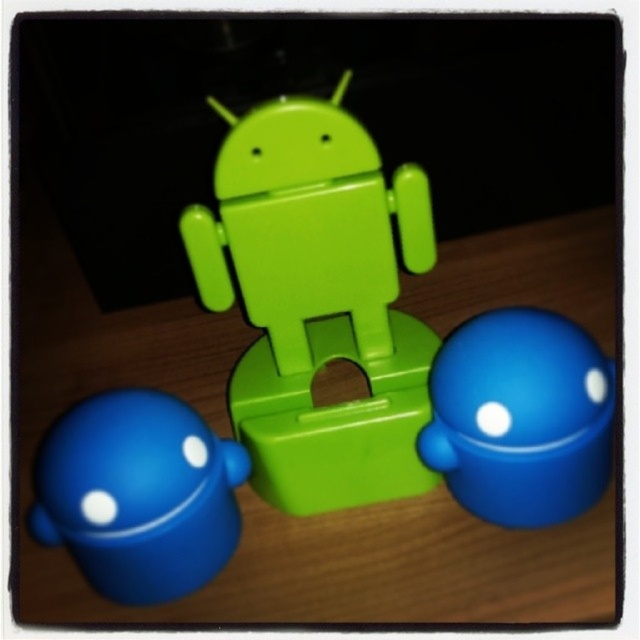
You are a child who wants to place a small toy on top of the wooden table at center. The toy is exactly the same height as the green matte android at center. Will the toy fit on the table without hanging over the edge?

The wooden table at center has a greater height compared to the green matte android at center. Since the toy is the same height as the green matte android at center, it will fit on the table without hanging over the edge because the table is taller than the toy.

You are standing at the point marked as point (260,476) and want to reach the door located at the opposite side of the room. There are three Android figurines in your path. The central green Android is directly in front of you, while the two smaller blue Androids are to your left and right. Considering their positions, which path should you take to avoid them?

To avoid the Android figurines, you should take the path to the left or right of the central green Android, as the two smaller blue Androids are positioned to your left and right, creating a clear path around the central figure.